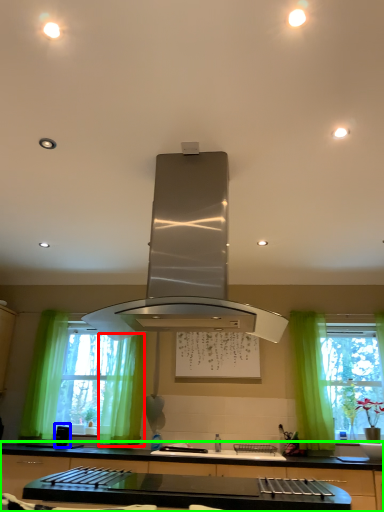
Question: Which is farther away from curtain (highlighted by a red box)? appliance (highlighted by a blue box) or countertop (highlighted by a green box)?

Choices:
 (A) appliance
 (B) countertop

Answer: (B)